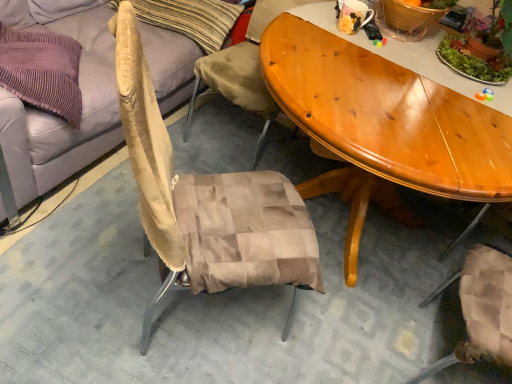
Question: Is beige fabric couch at upper left to the left or to the right of matte ceramic mug at upper center in the image?

Choices:
 (A) left
 (B) right

Answer: (A)

Question: From a real-world perspective, is beige fabric couch at upper left physically located above or below matte ceramic mug at upper center?

Choices:
 (A) above
 (B) below

Answer: (B)

Question: Which object is positioned closest to the beige fabric couch at upper left?

Choices:
 (A) green leafy plant at upper right
 (B) matte ceramic mug at upper center
 (C) beige fabric pillow at upper left

Answer: (C)

Question: Which object is the closest to the matte ceramic mug at upper center?

Choices:
 (A) beige fabric pillow at upper left
 (B) beige fabric couch at upper left
 (C) green leafy plant at upper right

Answer: (C)